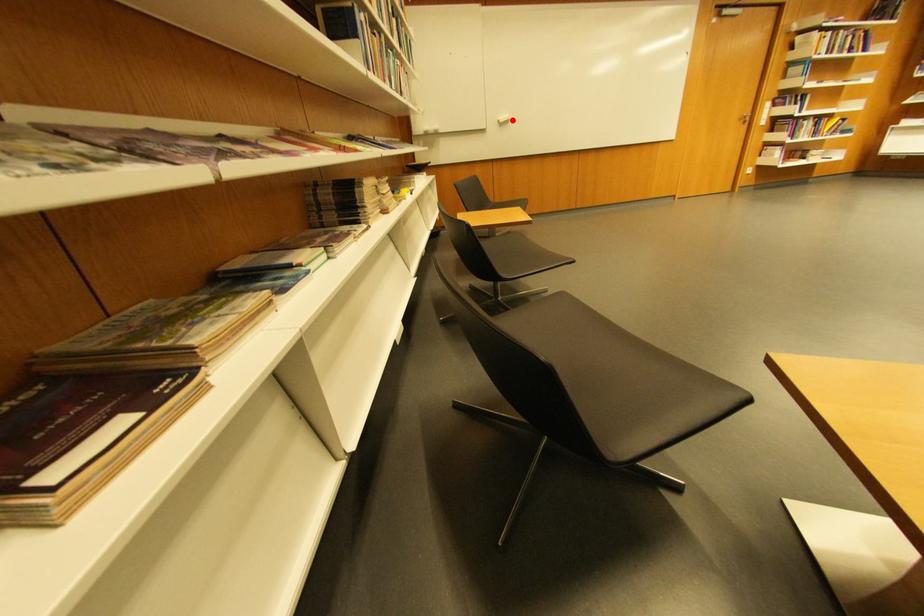
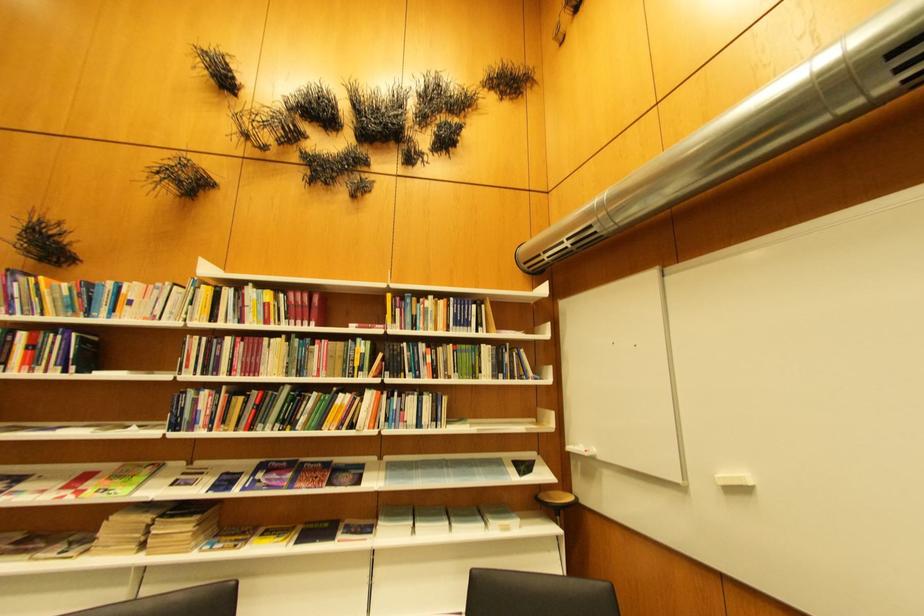
The point at the highlighted location is marked in the first image. Where is the corresponding point in the second image?

(738, 479)